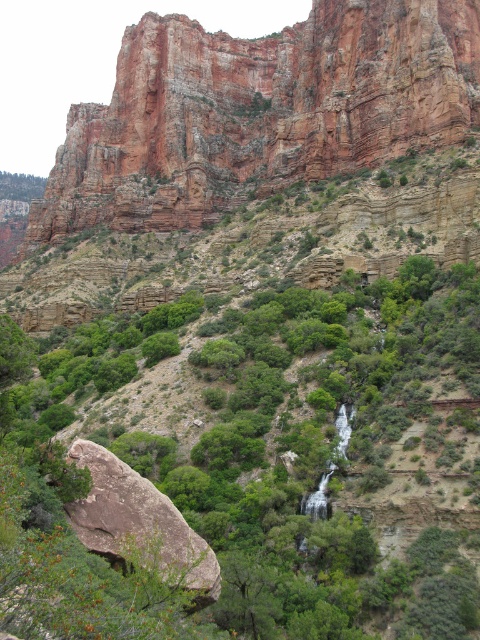
Question: Can you confirm if green leafy tree at center is positioned to the right of rustic rock cliff at upper center?

Choices:
 (A) no
 (B) yes

Answer: (B)

Question: Which point is farther to the camera?

Choices:
 (A) green leafy tree at center
 (B) rustic rock cliff at upper center
 (C) brown rough rock at lower left

Answer: (B)

Question: Is green leafy tree at center below brown rough rock at lower left?

Choices:
 (A) no
 (B) yes

Answer: (A)

Question: Which point appears closest to the camera in this image?

Choices:
 (A) (275, 353)
 (B) (111, 512)

Answer: (B)

Question: Considering the real-world distances, which object is closest to the green leafy tree at center?

Choices:
 (A) rustic rock cliff at upper center
 (B) brown rough rock at lower left

Answer: (B)

Question: Does green leafy tree at center lie behind brown rough rock at lower left?

Choices:
 (A) yes
 (B) no

Answer: (A)